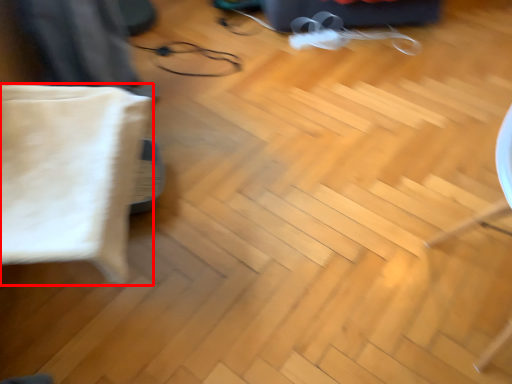
Question: Where is pillow (annotated by the red box) located in relation to glasses in the image?

Choices:
 (A) left
 (B) right

Answer: (A)